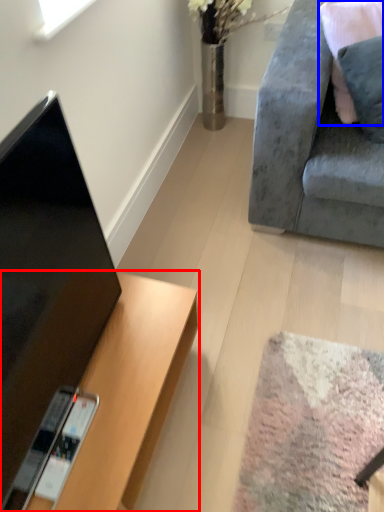
Question: Which object appears farthest to the camera in this image, desk (highlighted by a red box) or pillow (highlighted by a blue box)?

Choices:
 (A) desk
 (B) pillow

Answer: (B)